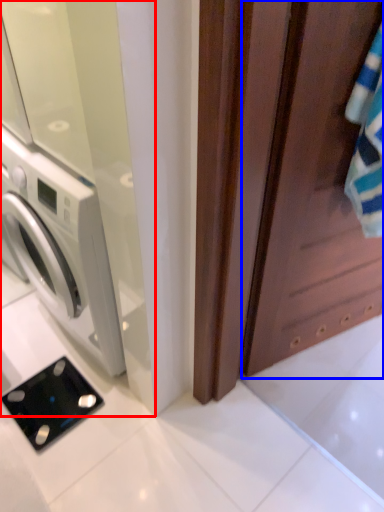
Question: Which object appears closest to the camera in this image, screen door (highlighted by a red box) or screen door (highlighted by a blue box)?

Choices:
 (A) screen door
 (B) screen door

Answer: (B)